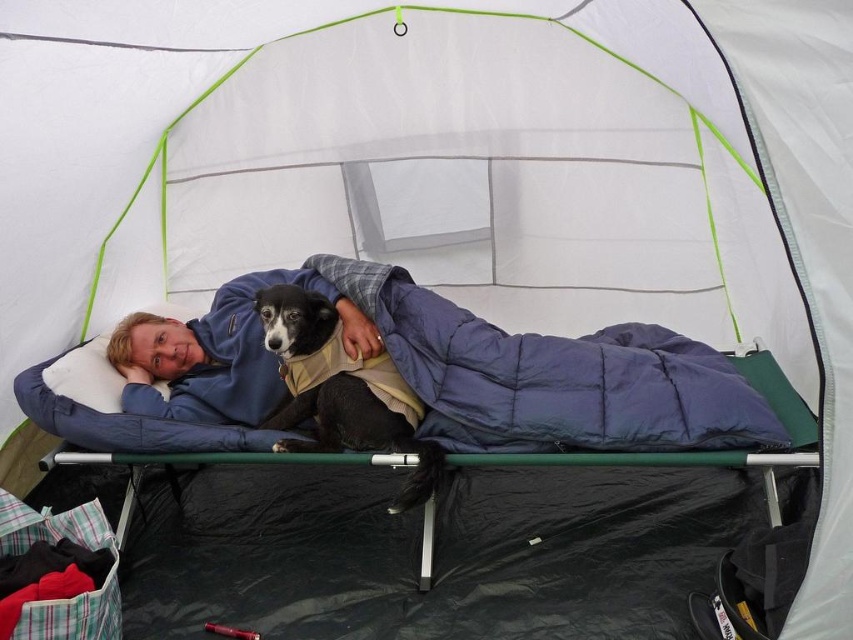
You are setting up a tent and need to place two stakes. The first stake must be placed at point A, which is at coordinate point(450, 412), and the second stake must be placed at point B, which is at coordinate point(302, 412). From the perspective of someone inside the tent looking out, which point is closer to the entrance?

Point A at coordinate point(450, 412) is in front of point B at coordinate point(302, 412), so point A is closer to the entrance.